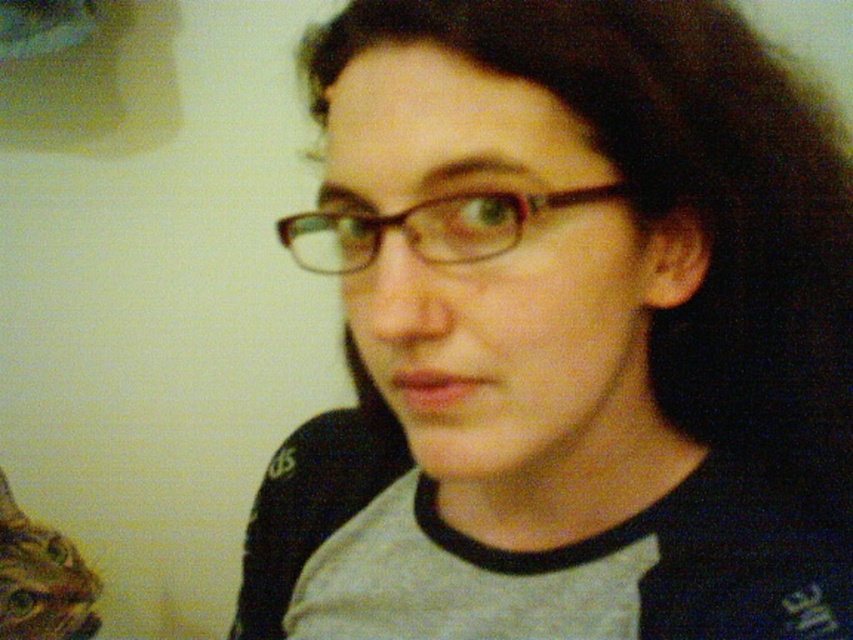
Question: Among these points, which one is farthest from the camera?

Choices:
 (A) (761, 224)
 (B) (373, 253)

Answer: (A)

Question: Which of the following is the closest to the observer?

Choices:
 (A) 402,221
 (B) 456,232

Answer: (B)

Question: Can you confirm if matte plastic glasses at center is positioned to the left of brown plastic glasses at center?

Choices:
 (A) yes
 (B) no

Answer: (B)

Question: In this image, where is matte plastic glasses at center located relative to brown plastic glasses at center?

Choices:
 (A) right
 (B) left

Answer: (A)

Question: Which point is farther to the camera?

Choices:
 (A) (711, 460)
 (B) (468, 234)

Answer: (A)

Question: Is matte plastic glasses at center smaller than brown plastic glasses at center?

Choices:
 (A) yes
 (B) no

Answer: (B)